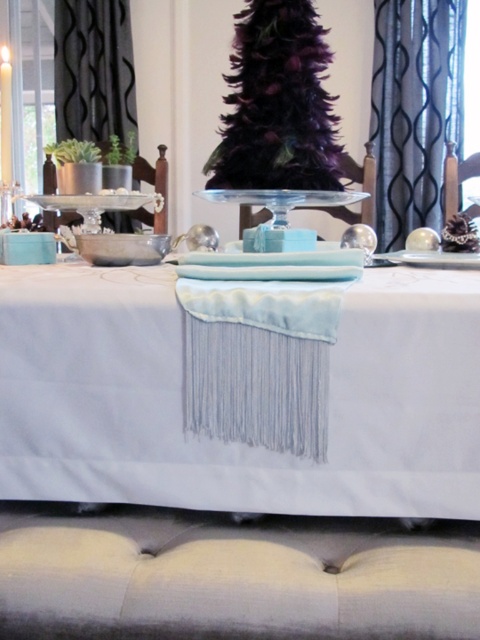
You are a guest at this festive table. You need to place a small decorative item on the table. Which object, the light blue fabric at center or the black textured curtain at left, has more space available to place it without overlapping anything?

The light blue fabric at center has more space available because it might be wider than the black textured curtain at left.

You are a guest at the festive dinner and want to place your napkin on the table. The satin blue curtain at upper right is in your way. Can you move the dark purple feathered christmas tree at center out of the way?

The dark purple feathered christmas tree at center is below the satin blue curtain at upper right, so moving it might help you access the area under the curtain. However, since the tree is part of the festive decoration, it might not be advisable to move it without permission.

You are a guest at this festive table and want to reach both the point at coordinates (405, 218) and the point at coordinates (73, 58). Which point will you need to stretch your arm further to reach?

The point at coordinates (73, 58) requires stretching your arm further because it is farther from you than the point at coordinates (405, 218).